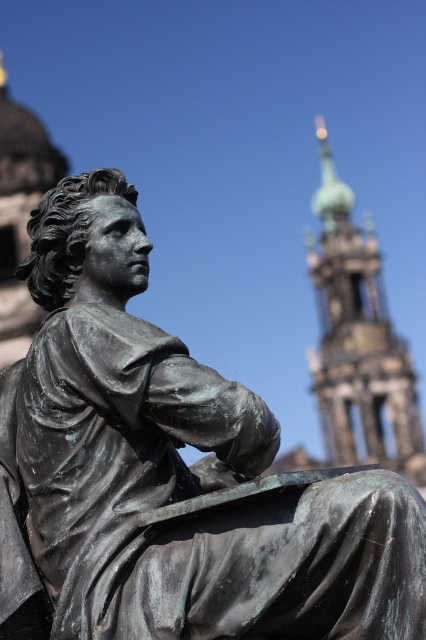
Question: Is bronze statue at center to the left of green copper tower at upper right from the viewer's perspective?

Choices:
 (A) no
 (B) yes

Answer: (B)

Question: Is bronze statue at center above green copper tower at upper right?

Choices:
 (A) no
 (B) yes

Answer: (A)

Question: Among these points, which one is farthest from the camera?

Choices:
 (A) (336, 179)
 (B) (106, 340)

Answer: (A)

Question: Does bronze statue at center appear on the left side of green copper tower at upper right?

Choices:
 (A) no
 (B) yes

Answer: (B)

Question: Among these points, which one is farthest from the camera?

Choices:
 (A) (135, 410)
 (B) (370, 248)

Answer: (B)